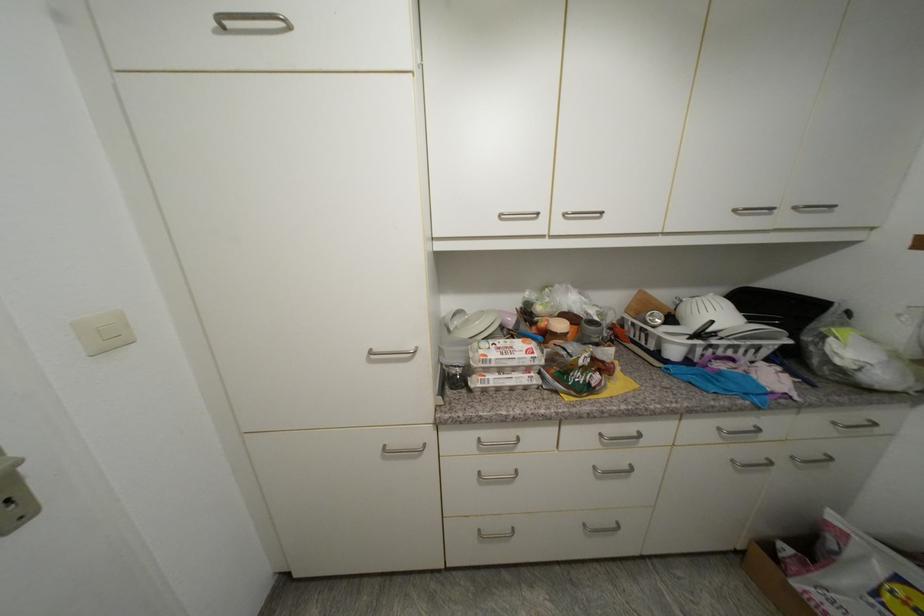
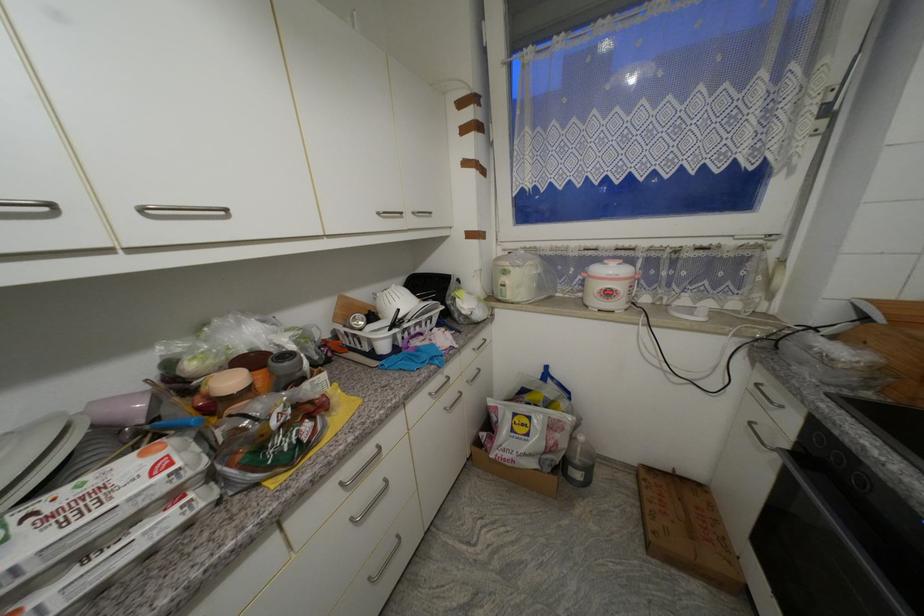
Question: The first image is from the beginning of the video and the second image is from the end. How did the camera likely rotate when shooting the video?

Choices:
 (A) Left
 (B) Right
 (C) Up
 (D) Down

Answer: (B)